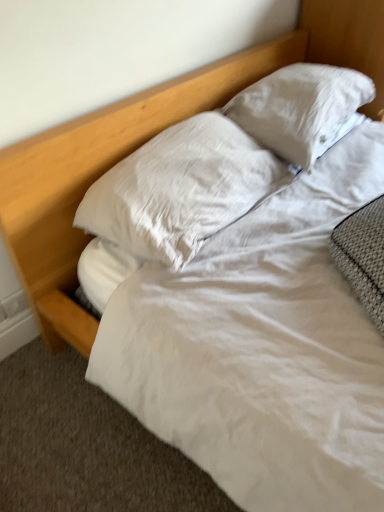
Question: Which direction should I rotate to look at white satin pillow at upper center, which is counted as the 2th pillow, starting from the left?

Choices:
 (A) left
 (B) right

Answer: (B)

Question: From a real-world perspective, is white soft pillow at center, the 1th pillow in the left-to-right sequence, on top of white satin pillow at upper center, marked as the first pillow in a right-to-left arrangement?

Choices:
 (A) yes
 (B) no

Answer: (B)

Question: Are white soft pillow at center, the 2th pillow viewed from the right, and white satin pillow at upper center, which is counted as the 2th pillow, starting from the left, located far from each other?

Choices:
 (A) yes
 (B) no

Answer: (B)

Question: Is white soft pillow at center, the 1th pillow in the left-to-right sequence, completely or partially outside of white satin pillow at upper center, which is counted as the 2th pillow, starting from the left?

Choices:
 (A) yes
 (B) no

Answer: (A)

Question: Can you confirm if white soft pillow at center, the 1th pillow in the left-to-right sequence, is positioned to the right of white satin pillow at upper center, marked as the first pillow in a right-to-left arrangement?

Choices:
 (A) no
 (B) yes

Answer: (A)

Question: Does white soft pillow at center, the 1th pillow in the left-to-right sequence, have a larger size compared to white satin pillow at upper center, marked as the first pillow in a right-to-left arrangement?

Choices:
 (A) no
 (B) yes

Answer: (A)

Question: Is white soft pillow at center, the 2th pillow viewed from the right, looking in the opposite direction of white satin pillow at upper center, marked as the first pillow in a right-to-left arrangement?

Choices:
 (A) yes
 (B) no

Answer: (B)

Question: From the image's perspective, is white satin pillow at upper center, which is counted as the 2th pillow, starting from the left, under white soft pillow at center, the 2th pillow viewed from the right?

Choices:
 (A) yes
 (B) no

Answer: (B)

Question: Is white satin pillow at upper center, marked as the first pillow in a right-to-left arrangement, bigger than white soft pillow at center, the 2th pillow viewed from the right?

Choices:
 (A) no
 (B) yes

Answer: (B)

Question: From a real-world perspective, is white satin pillow at upper center, which is counted as the 2th pillow, starting from the left, beneath white soft pillow at center, the 2th pillow viewed from the right?

Choices:
 (A) yes
 (B) no

Answer: (B)

Question: Is white satin pillow at upper center, marked as the first pillow in a right-to-left arrangement, oriented towards white soft pillow at center, the 1th pillow in the left-to-right sequence?

Choices:
 (A) no
 (B) yes

Answer: (A)

Question: Is white satin pillow at upper center, which is counted as the 2th pillow, starting from the left, further to camera compared to white soft pillow at center, the 1th pillow in the left-to-right sequence?

Choices:
 (A) yes
 (B) no

Answer: (A)

Question: Is white satin pillow at upper center, which is counted as the 2th pillow, starting from the left, facing away from white soft pillow at center, the 2th pillow viewed from the right?

Choices:
 (A) yes
 (B) no

Answer: (B)

Question: From a real-world perspective, is white soft pillow at center, the 1th pillow in the left-to-right sequence, positioned above or below white satin pillow at upper center, marked as the first pillow in a right-to-left arrangement?

Choices:
 (A) below
 (B) above

Answer: (A)